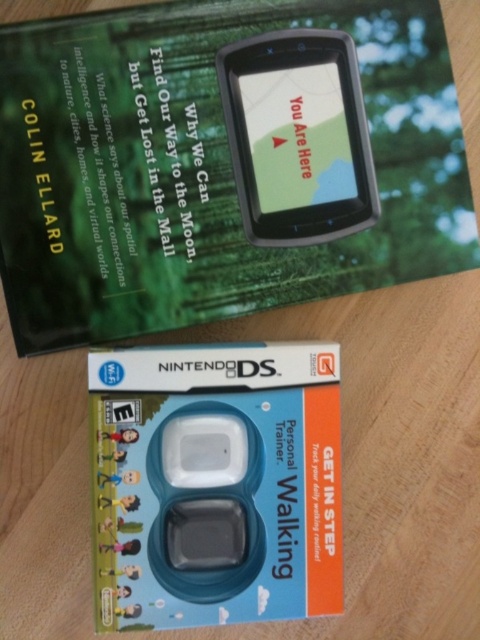
What is the position of the point labeled as point (215, 483)?

The point labeled as point (215, 483) is on blue plastic nintendo ds at center.

What are the coordinates of the blue plastic nintendo ds at center?

The blue plastic nintendo ds at center is located at coordinates point (x=215, y=483).